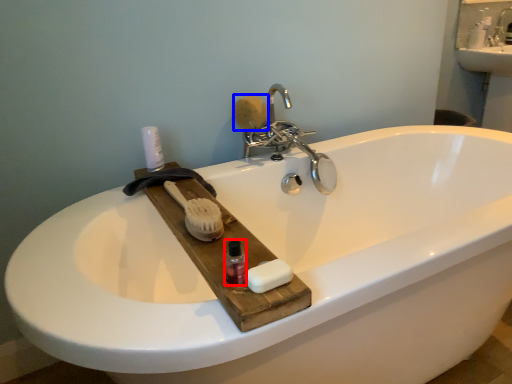
Question: Which of the following is the closest to the observer, mouthwash (highlighted by a red box) or soap (highlighted by a blue box)?

Choices:
 (A) mouthwash
 (B) soap

Answer: (A)